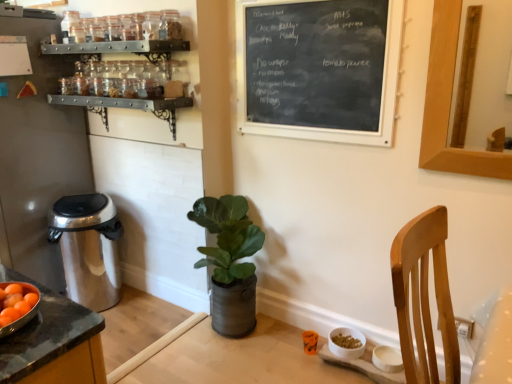
Question: Based on their sizes in the image, would you say black chalkboard at upper center is bigger or smaller than brushed metal trash can at left?

Choices:
 (A) small
 (B) big

Answer: (A)

Question: From their relative heights in the image, would you say black chalkboard at upper center is taller or shorter than brushed metal trash can at left?

Choices:
 (A) tall
 (B) short

Answer: (B)

Question: Which object is positioned closest to the black chalkboard at upper center?

Choices:
 (A) metallic spice rack at upper left, placed as the 2th shelf when sorted from bottom to top
 (B) brushed metal trash can at left
 (C) satin silver trash can at left
 (D) green leafy plant in metallic pot at center
 (E) metallic black spice rack at upper left, arranged as the 1th shelf when ordered from the bottom

Answer: (E)

Question: Estimate the real-world distances between objects in this image. Which object is closer to the satin silver trash can at left?

Choices:
 (A) brushed metal trash can at left
 (B) metallic black spice rack at upper left, arranged as the second shelf when viewed from the top
 (C) green leafy plant in metallic pot at center
 (D) metallic spice rack at upper left, placed as the 2th shelf when sorted from bottom to top
 (E) black chalkboard at upper center

Answer: (A)